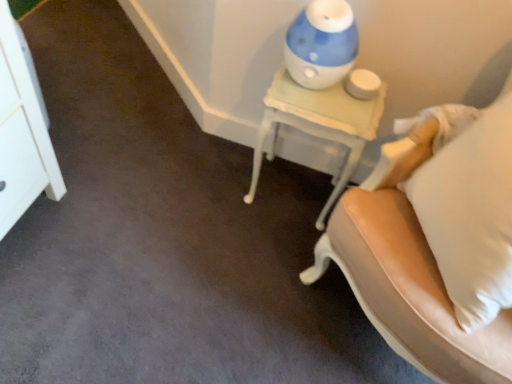
You are a GUI agent. You are given a task and a screenshot of the screen. Output one action in this format:
    pyautogui.click(x=<x>, y=<y>)
    Task: Click on the vacant space underneath white painted wood nightstand at upper right (from a real-world perspective)
    Image resolution: width=512 pixels, height=384 pixels.
    Given the screenshot: What is the action you would take?
    pyautogui.click(x=290, y=189)